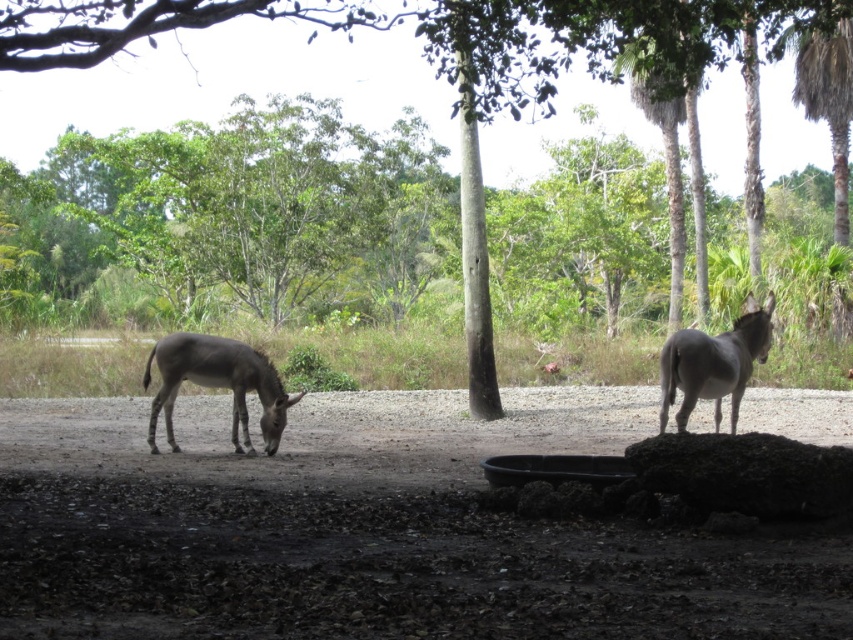
Can you confirm if dark brown dirt field at center is positioned below gray matte donkey at left?

Yes, dark brown dirt field at center is below gray matte donkey at left.

Who is higher up, dark brown dirt field at center or gray matte donkey at left?

gray matte donkey at left

Does point (354, 461) come behind point (235, 371)?

That is False.

Find the location of a particular element. dark brown dirt field at center is located at coordinates (370, 531).

Is brown smooth tree at center positioned before gray matte donkey at right?

Yes, it is.

In the scene shown: Is brown smooth tree at center shorter than gray matte donkey at right?

In fact, brown smooth tree at center may be taller than gray matte donkey at right.

Is point (465, 77) less distant than point (674, 362)?

No, it is behind (674, 362).

Find the location of a particular element. brown smooth tree at center is located at coordinates (422, 52).

Which is behind, point (309, 554) or point (483, 33)?

The point (483, 33) is behind.

Can you confirm if dark brown dirt field at center is taller than brown smooth tree at center?

Incorrect, dark brown dirt field at center's height is not larger of brown smooth tree at center's.

Who is more forward, (479, 422) or (554, 49)?

Positioned in front is point (479, 422).

In order to click on dark brown dirt field at center in this screenshot , I will do `click(370, 531)`.